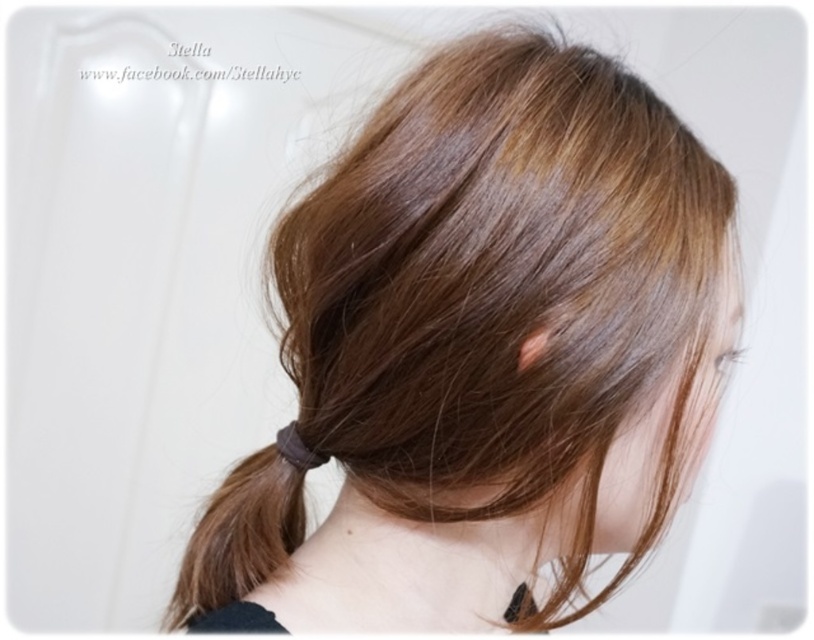
Who is higher up, brown matte hair at center or brown rubber band at center?

Positioned higher is brown matte hair at center.

Who is shorter, brown matte hair at center or brown rubber band at center?

brown rubber band at center is shorter.

Is point (364, 330) farther from viewer compared to point (204, 561)?

No, (364, 330) is in front of (204, 561).

The image size is (814, 640). What are the coordinates of `brown matte hair at center` in the screenshot? It's located at (480, 355).